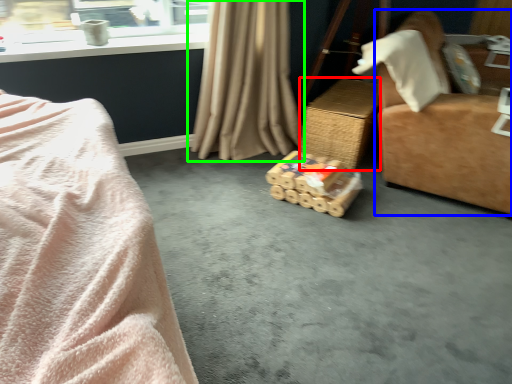
Question: Considering the real-world distances, which object is closest to table (highlighted by a red box)? furniture (highlighted by a blue box) or curtain (highlighted by a green box).

Choices:
 (A) furniture
 (B) curtain

Answer: (B)